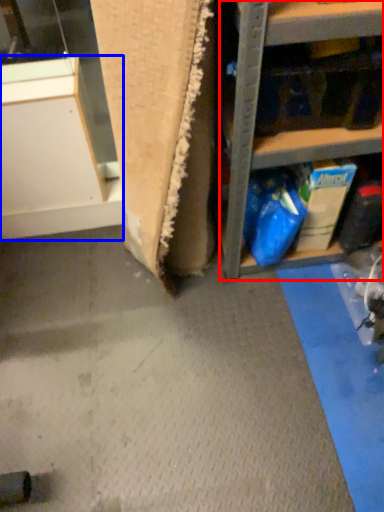
Question: Which object appears farthest to the camera in this image, shelf (highlighted by a red box) or cabinetry (highlighted by a blue box)?

Choices:
 (A) shelf
 (B) cabinetry

Answer: (B)